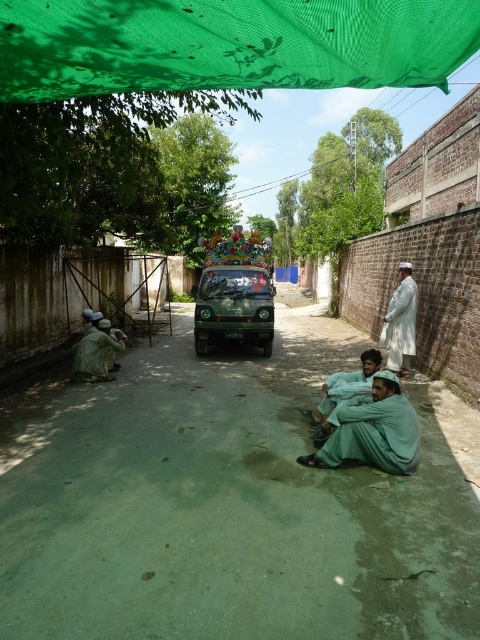
Question: Where is green concrete alley at center located in relation to green matte jeep at center in the image?

Choices:
 (A) left
 (B) right

Answer: (B)

Question: Does green cotton robe at lower center have a greater width compared to white cotton robe at right?

Choices:
 (A) yes
 (B) no

Answer: (A)

Question: Among these points, which one is nearest to the camera?

Choices:
 (A) (289, 65)
 (B) (358, 372)
 (C) (203, 276)
 (D) (104, 336)

Answer: (A)

Question: Does light green fabric at center appear under green fabric robe at lower left?

Choices:
 (A) yes
 (B) no

Answer: (A)

Question: Among these points, which one is farthest from the camera?

Choices:
 (A) (240, 336)
 (B) (169, 22)
 (C) (110, 339)

Answer: (A)

Question: Which object is farther from the camera taking this photo?

Choices:
 (A) green concrete alley at center
 (B) green cotton robe at lower center
 (C) green matte jeep at center

Answer: (C)